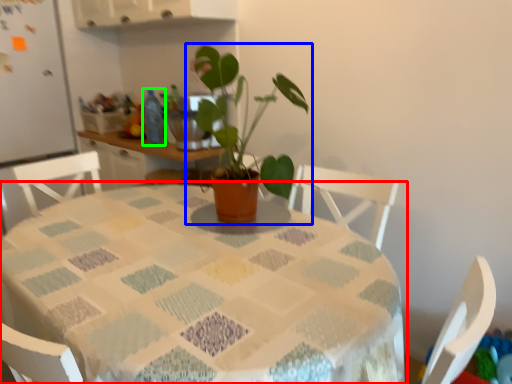
Question: Which object is positioned farthest from table (highlighted by a red box)? Select from houseplant (highlighted by a blue box) and bottle (highlighted by a green box).

Choices:
 (A) houseplant
 (B) bottle

Answer: (B)